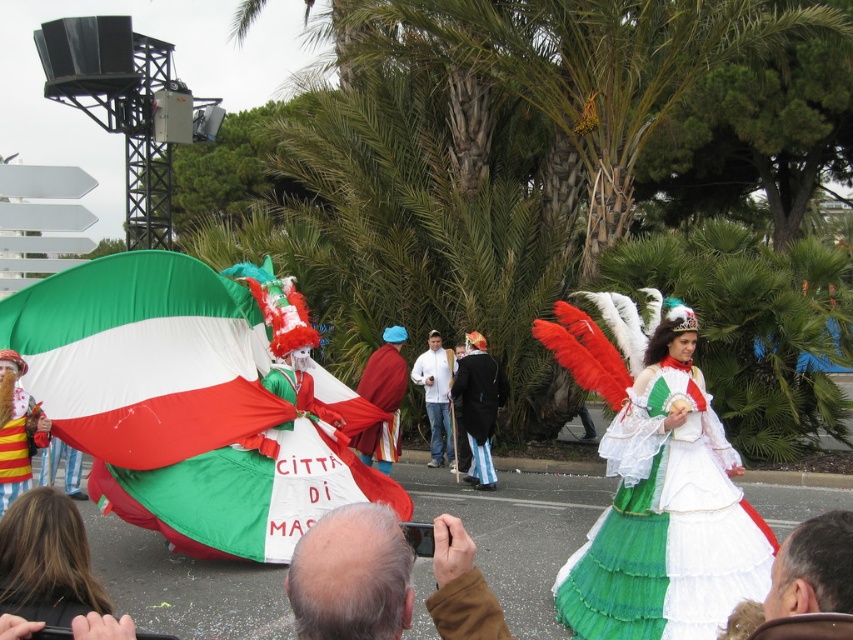
The width and height of the screenshot is (853, 640). Describe the element at coordinates (656, 484) in the screenshot. I see `white lace dress at center` at that location.

You are a GUI agent. You are given a task and a screenshot of the screen. Output one action in this format:
    pyautogui.click(x=<x>, y=<y>)
    Task: Click on the white lace dress at center
    This screenshot has width=853, height=640.
    Given the screenshot: What is the action you would take?
    pyautogui.click(x=656, y=484)

Locate an element on the screen. white lace dress at center is located at coordinates (656, 484).

Can you confirm if white lace dress at center is positioned above velvet maroon cape at center?

Incorrect, white lace dress at center is not positioned above velvet maroon cape at center.

Which is below, white lace dress at center or velvet maroon cape at center?

white lace dress at center is lower down.

Who is more distant from viewer, (747, 580) or (384, 381)?

The point (384, 381) is behind.

Where is `white lace dress at center`? This screenshot has height=640, width=853. white lace dress at center is located at coordinates (x=656, y=484).

Is gray hair at upper center bigger than velvet maroon cape at center?

Incorrect, gray hair at upper center is not larger than velvet maroon cape at center.

Does point (488, 616) come behind point (398, 451)?

No, (488, 616) is in front of (398, 451).

You are a GUI agent. You are given a task and a screenshot of the screen. Output one action in this format:
    pyautogui.click(x=<x>, y=<y>)
    Task: Click on the gray hair at upper center
    The width and height of the screenshot is (853, 640).
    Given the screenshot: What is the action you would take?
    pyautogui.click(x=351, y=577)